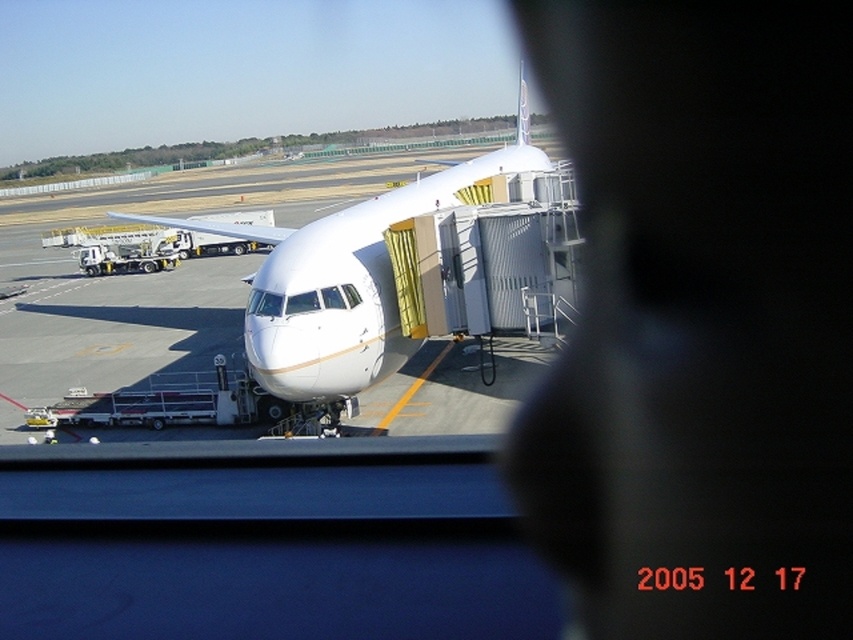
You are standing on the airport tarmac and want to approach the white glossy airplane at center. The safety regulations state that you must stay at least 10 meters away from any aircraft. Are you currently within the safe distance?

The white glossy airplane at center is 8.86 meters away from you, which is less than the required 10 meters safety distance. Therefore, you are too close and should move back to comply with safety regulations.

You are a ground crew member who needs to position a new baggage cart. The cart must be placed exactly 2 meters to the northeast of the white glossy airplane at center. Given the airport tarmac coordinates, can you confirm the new coordinates for the cart placement?

The white glossy airplane at center is located at point (345, 280). Adding 2 meters northeast would require converting the coordinate system to meters, but since the coordinate system isn not specified, precise calculation isn possible. However, the cart should be placed 2 meters northeast of the airplane at center.

You are a maintenance worker at the airport. You need to inspect both the white glossy airplane at center and the transparent glass airplane window at center. Which object should you check first if you want to start with the larger one?

The white glossy airplane at center is larger in size than the transparent glass airplane window at center, so you should check the white glossy airplane at center first.